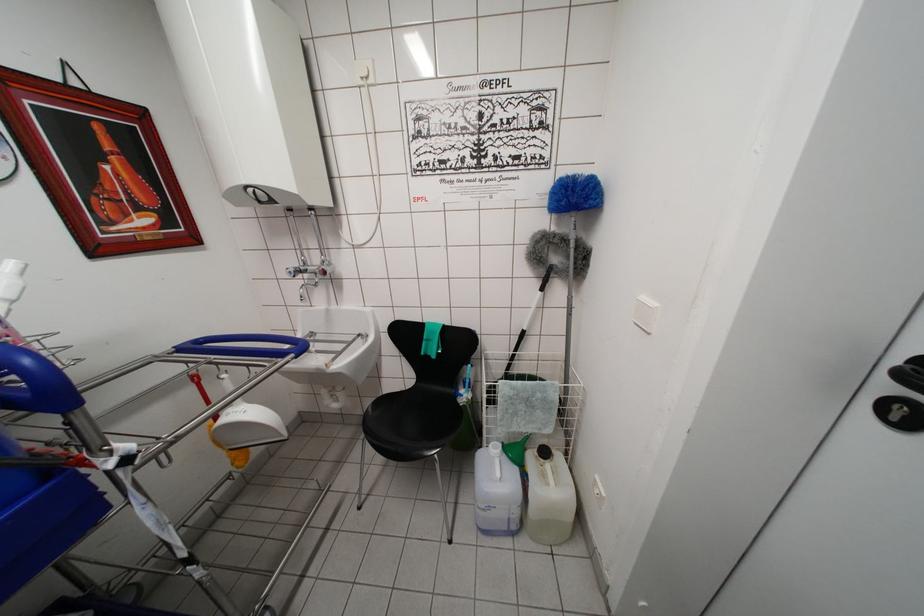
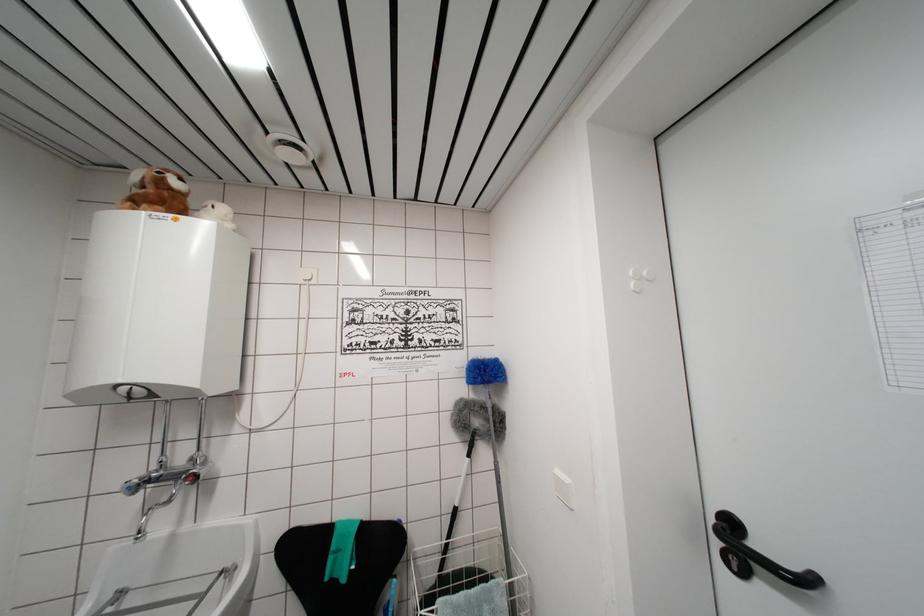
Locate, in the second image, the point that corresponds to (324,272) in the first image.

(197, 476)